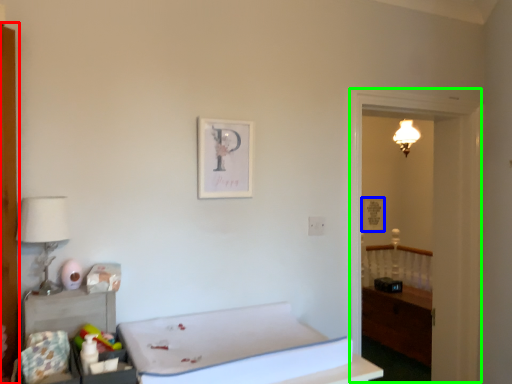
Question: Estimate the real-world distances between objects in this image. Which object is closer to armoire (highlighted by a red box), picture frame (highlighted by a blue box) or window (highlighted by a green box)?

Choices:
 (A) picture frame
 (B) window

Answer: (B)